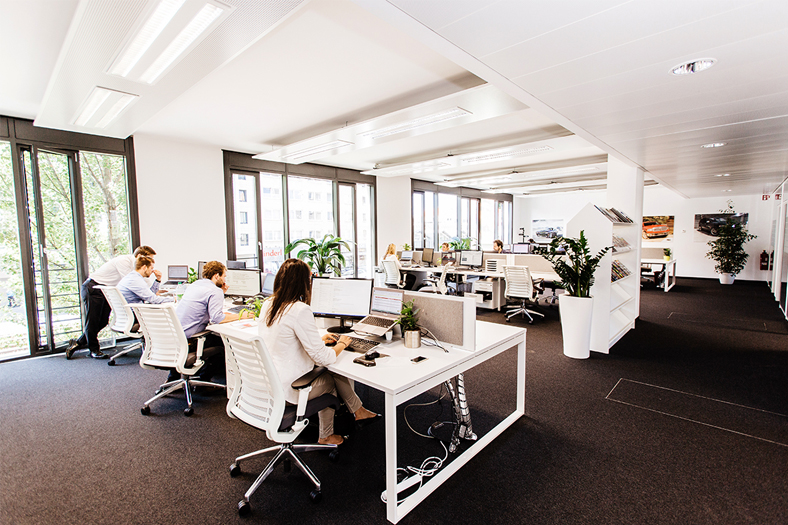
Locate an element on the screen. Image resolution: width=788 pixels, height=525 pixels. monitors is located at coordinates (344, 295), (246, 284), (169, 274), (199, 262), (232, 262), (430, 251), (476, 258), (522, 246).